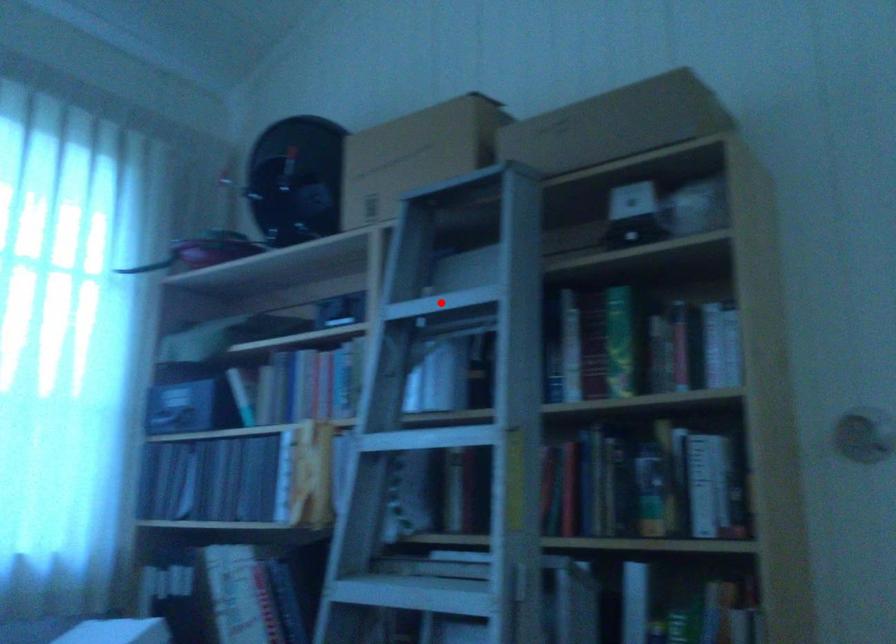
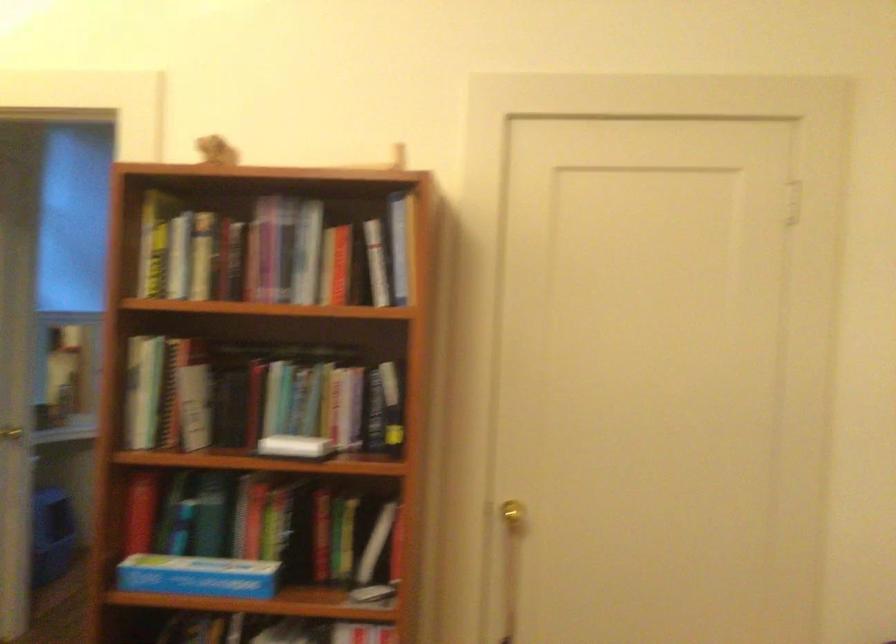
Question: I am providing you with two images of the same scene from different viewpoints. A red point is marked on the first image. Can you still see the location of the red point in image 2?

Choices:
 (A) Yes
 (B) No

Answer: (B)